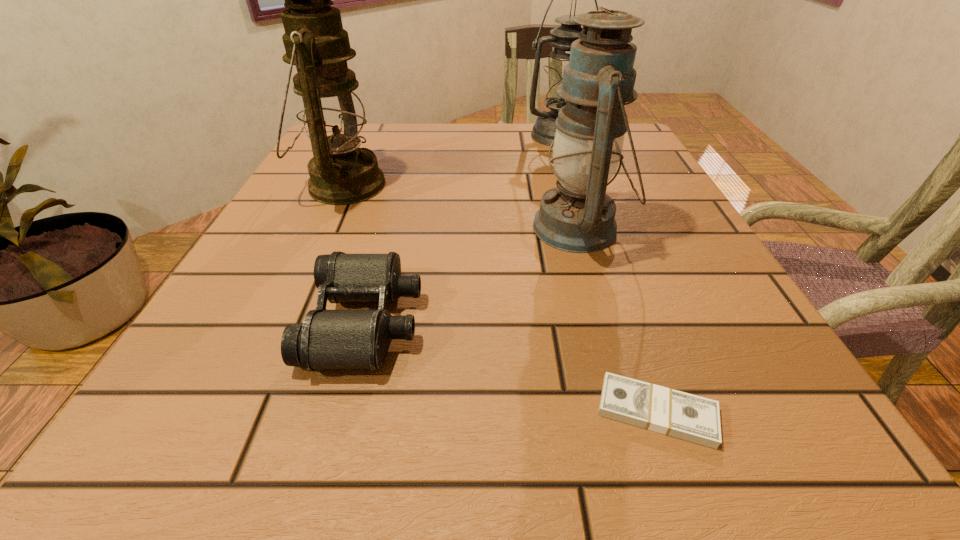
This screenshot has width=960, height=540. What are the coordinates of `vacant space that satisfies the following two spatial constraints: 1. through the eyepieces of the fourth tallest object; 2. on the left side of the shortest object` in the screenshot? It's located at (341, 411).